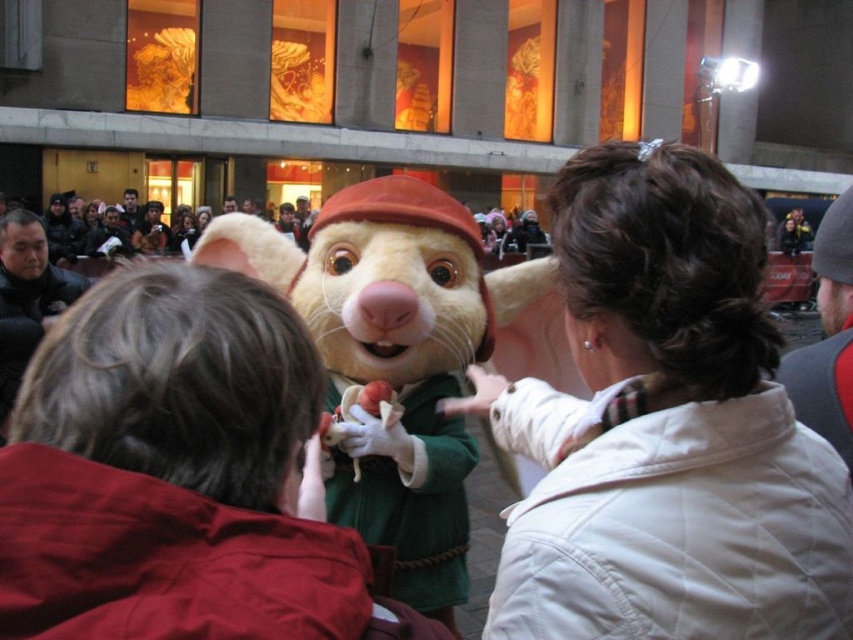
Question: Can you confirm if white quilted jacket at center is positioned below fluffy beige costume at center?

Choices:
 (A) yes
 (B) no

Answer: (B)

Question: Among these objects, which one is nearest to the camera?

Choices:
 (A) white quilted jacket at center
 (B) fluffy beige costume at center

Answer: (A)

Question: Does white quilted jacket at center appear over fluffy beige costume at center?

Choices:
 (A) yes
 (B) no

Answer: (A)

Question: Is white quilted jacket at center bigger than fluffy beige costume at center?

Choices:
 (A) yes
 (B) no

Answer: (A)